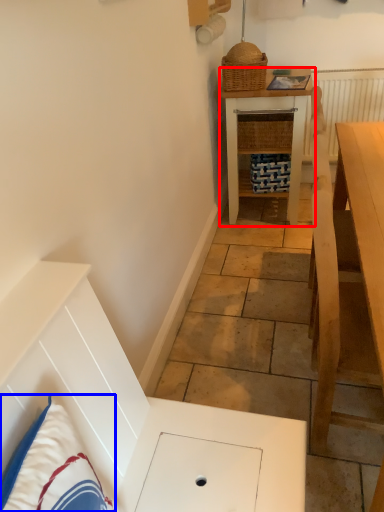
Question: Which point is closer to the camera, table (highlighted by a red box) or pillow (highlighted by a blue box)?

Choices:
 (A) table
 (B) pillow

Answer: (B)